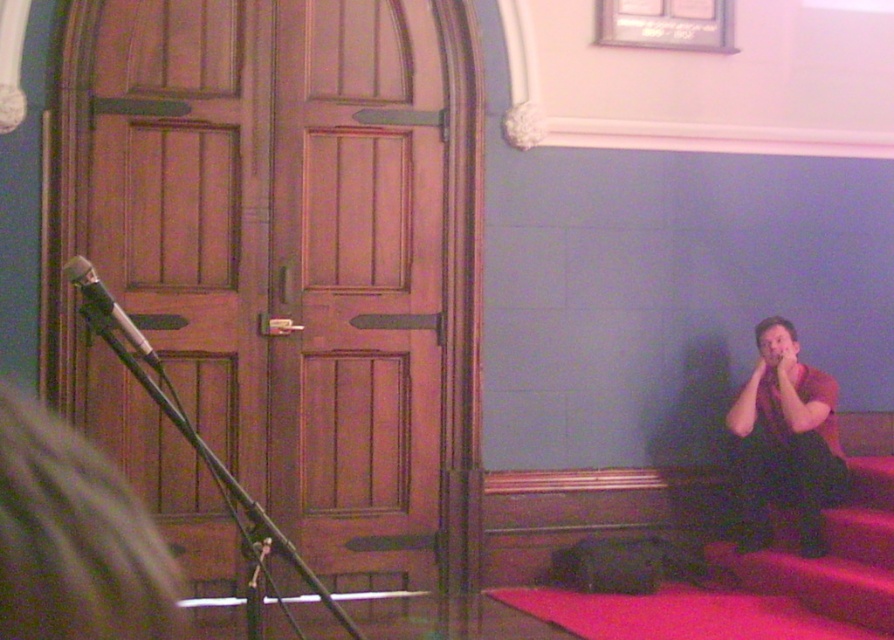
Is point (808, 570) positioned before point (148, 352)?

No, it is behind (148, 352).

Is smooth wooden stairs at lower right below metallic silver microphone at left?

Yes, smooth wooden stairs at lower right is below metallic silver microphone at left.

Which is behind, point (760, 563) or point (133, 324)?

Positioned behind is point (760, 563).

Locate an element on the screen. Image resolution: width=894 pixels, height=640 pixels. smooth wooden stairs at lower right is located at coordinates [x=837, y=556].

Can you confirm if matte black microphone at left is wider than metallic silver microphone at left?

Indeed, matte black microphone at left has a greater width compared to metallic silver microphone at left.

Who is taller, matte black microphone at left or metallic silver microphone at left?

Standing taller between the two is matte black microphone at left.

Locate an element on the screen. matte black microphone at left is located at coordinates (74, 538).

This screenshot has width=894, height=640. What are the coordinates of `matte black microphone at left` in the screenshot? It's located at (74, 538).

Which is in front, point (112, 547) or point (761, 353)?

Point (112, 547) is in front.

Does matte black microphone at left appear on the right side of dark red shirt at right?

No, matte black microphone at left is not to the right of dark red shirt at right.

Does point (175, 564) come farther from viewer compared to point (778, 356)?

No, it is not.

Image resolution: width=894 pixels, height=640 pixels. Find the location of `matte black microphone at left`. matte black microphone at left is located at coordinates (74, 538).